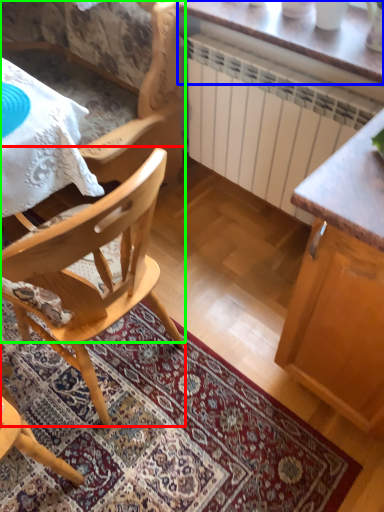
Question: Which object is the closest to the chair (highlighted by a red box)? Choose among these: table (highlighted by a blue box) or chair (highlighted by a green box).

Choices:
 (A) table
 (B) chair

Answer: (B)